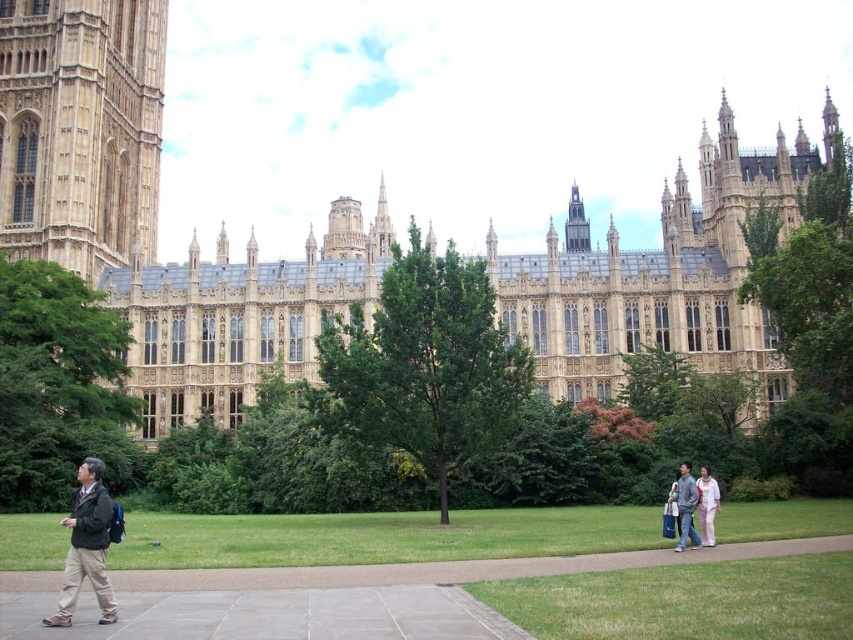
Question: Estimate the real-world distances between objects in this image. Which object is closer to the golden stone tower at upper left?

Choices:
 (A) light pink fabric pants at lower right
 (B) yellow stone building at center

Answer: (B)

Question: Among these points, which one is farthest from the camera?

Choices:
 (A) (65, 600)
 (B) (708, 518)

Answer: (B)

Question: Can you confirm if gray cotton jacket at lower right is positioned below dark gray stone bell tower at center?

Choices:
 (A) no
 (B) yes

Answer: (B)

Question: Can you confirm if dark green jacket at lower left is bigger than light pink fabric pants at lower right?

Choices:
 (A) no
 (B) yes

Answer: (B)

Question: Can you confirm if golden stone tower at upper left is positioned to the right of dark green jacket at lower left?

Choices:
 (A) no
 (B) yes

Answer: (A)

Question: Considering the real-world distances, which object is closest to the yellow stone building at center?

Choices:
 (A) dark gray stone bell tower at center
 (B) gray cotton jacket at lower right
 (C) light pink fabric pants at lower right

Answer: (A)